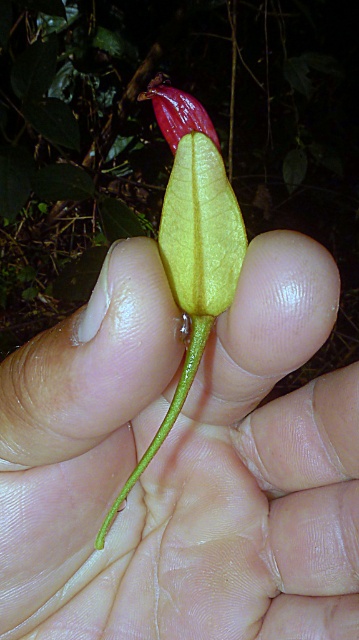
Which is above, yellow matte leaf at center or green glossy stem at center?

yellow matte leaf at center

Is yellow matte leaf at center above green glossy stem at center?

Yes, yellow matte leaf at center is above green glossy stem at center.

What do you see at coordinates (165, 140) in the screenshot? I see `yellow matte leaf at center` at bounding box center [165, 140].

You are a GUI agent. You are given a task and a screenshot of the screen. Output one action in this format:
    pyautogui.click(x=<x>, y=<y>)
    Task: Click on the yellow matte leaf at center
    The height and width of the screenshot is (640, 359).
    Given the screenshot: What is the action you would take?
    pyautogui.click(x=165, y=140)

Does yellow matte flower at center appear on the right side of yellow matte leaf at center?

Incorrect, yellow matte flower at center is not on the right side of yellow matte leaf at center.

Does point (109, 637) come closer to viewer compared to point (25, 301)?

Yes, it is.

Locate an element on the screen. yellow matte flower at center is located at coordinates (183, 461).

Does yellow matte flower at center come in front of glossy red flower at upper center?

Yes, yellow matte flower at center is in front of glossy red flower at upper center.

Who is lower down, yellow matte flower at center or glossy red flower at upper center?

yellow matte flower at center is lower down.

You are a GUI agent. You are given a task and a screenshot of the screen. Output one action in this format:
    pyautogui.click(x=<x>, y=<y>)
    Task: Click on the yellow matte flower at center
    The image size is (359, 640).
    Given the screenshot: What is the action you would take?
    pyautogui.click(x=183, y=461)